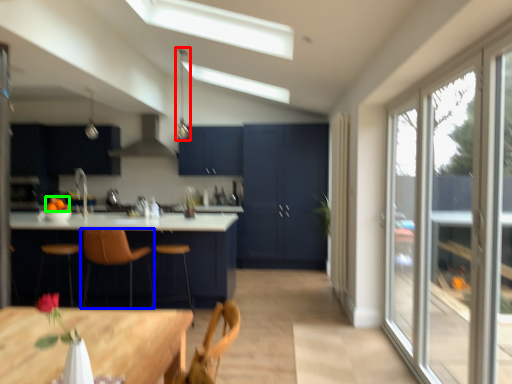
Question: Which object is the closest to the light fixture (highlighted by a red box)? Choose among these: chair (highlighted by a blue box) or fruit (highlighted by a green box).

Choices:
 (A) chair
 (B) fruit

Answer: (B)